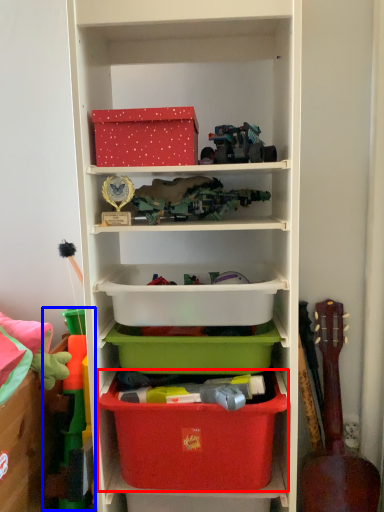
Question: Which of the following is the closest to the observer, storage box (highlighted by a red box) or toy (highlighted by a blue box)?

Choices:
 (A) storage box
 (B) toy

Answer: (A)